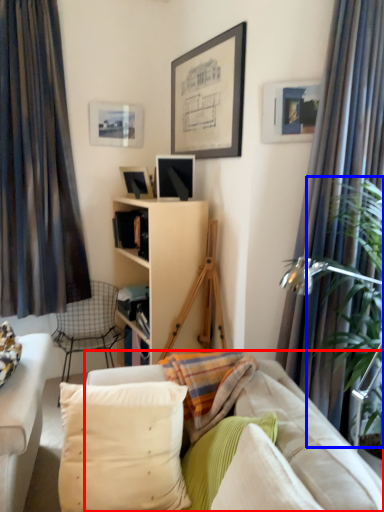
Question: Which point is further to the camera, studio couch (highlighted by a red box) or plant (highlighted by a blue box)?

Choices:
 (A) studio couch
 (B) plant

Answer: (B)